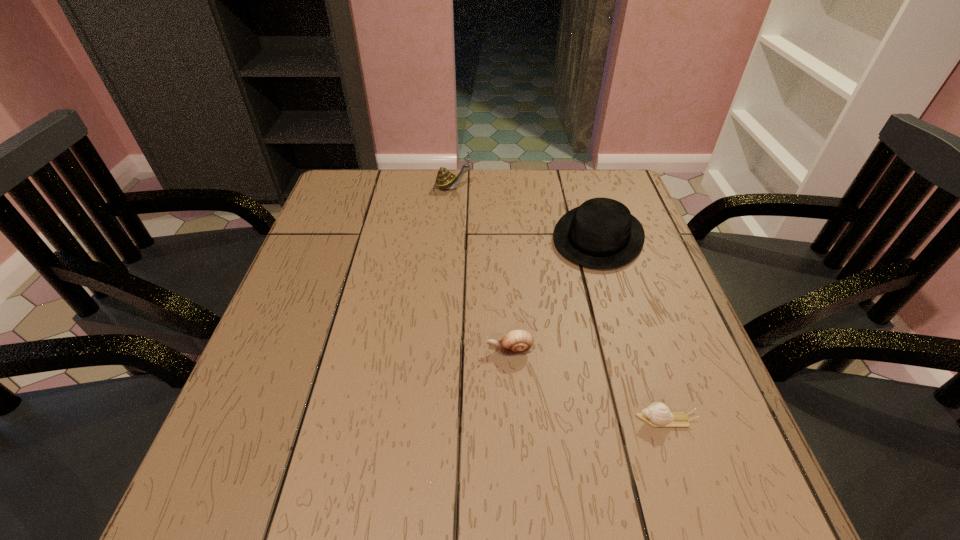
Locate an element on the screen. This screenshot has height=540, width=960. free spot that satisfies the following two spatial constraints: 1. on the face of the third nearest object; 2. on the right side of the farthest escargot is located at coordinates (448, 237).

Identify the location of vacant position in the image that satisfies the following two spatial constraints: 1. on the face of the leftmost escargot; 2. on the right side of the fedora. The height and width of the screenshot is (540, 960). (448, 237).

At what (x,y) coordinates should I click in order to perform the action: click on free space that satisfies the following two spatial constraints: 1. on the face of the fedora; 2. on the right side of the tallest object. Please return your answer as a coordinate pair (x, y). Image resolution: width=960 pixels, height=540 pixels. Looking at the image, I should click on (448, 237).

The image size is (960, 540). I want to click on free location that satisfies the following two spatial constraints: 1. on the face of the leftmost object; 2. on the back side of the second tallest object, so click(448, 237).